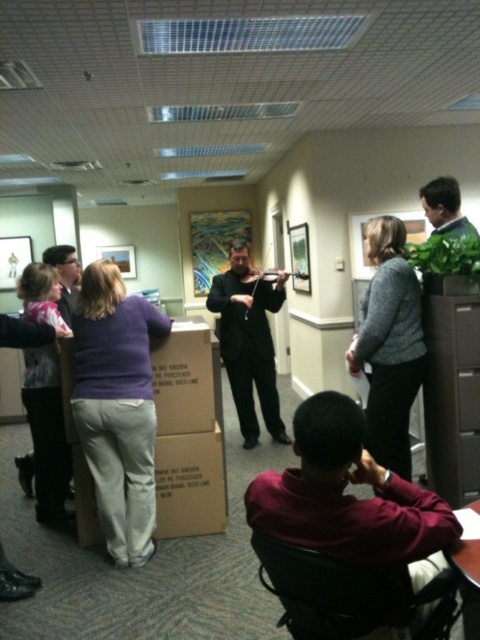
You are a tailor measuring garments for a client. You have a gray woolen sweater at center and a black matte suit at center in front of you. Which garment has a smaller width according to the measurements?

The gray woolen sweater at center has a smaller width than the black matte suit at center.

You are organizing a small performance in an office space and need to ensure there is enough space between the gray woolen sweater at center and the wooden violin at center for the performer to move comfortably. Given that the performer requires at least 0.5 meters of space, can they move freely between these two items?

The gray woolen sweater at center has a larger size compared to wooden violin at center. However, the description does not provide specific measurements of the distance between them, so we cannot determine if there is enough space for the performer to move freely.